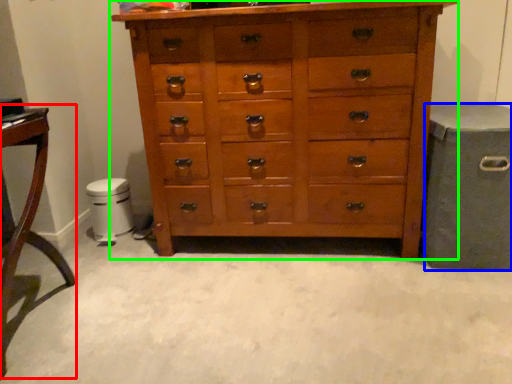
Question: Considering the real-world distances, which object is farthest from table (highlighted by a red box)? gray (highlighted by a blue box) or chest of drawers (highlighted by a green box)?

Choices:
 (A) gray
 (B) chest of drawers

Answer: (A)